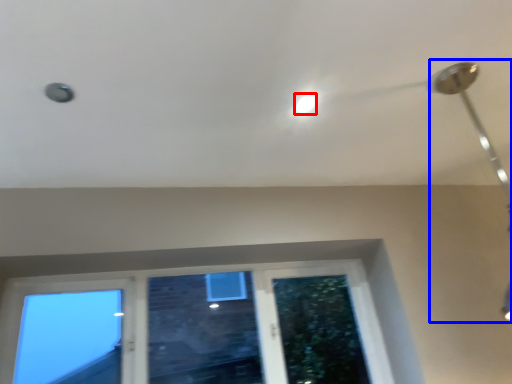
Question: Which object is further to the camera taking this photo, droplight (highlighted by a red box) or lamp (highlighted by a blue box)?

Choices:
 (A) droplight
 (B) lamp

Answer: (A)